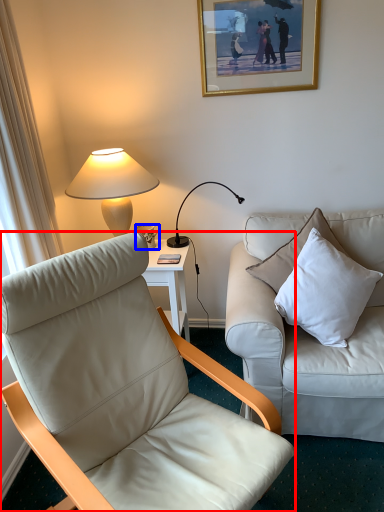
Question: Which object appears farthest to the camera in this image, chair (highlighted by a red box) or coffee cup (highlighted by a blue box)?

Choices:
 (A) chair
 (B) coffee cup

Answer: (B)